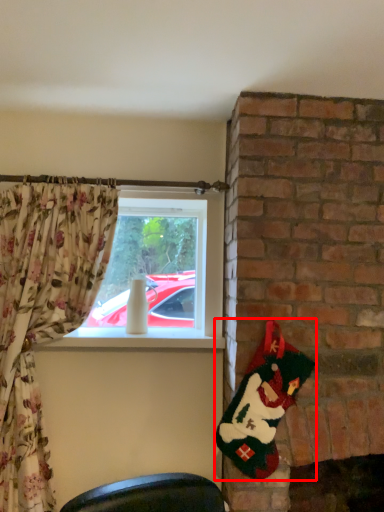
Question: From the image's perspective, where is santa claus (annotated by the red box) located in relation to window in the image?

Choices:
 (A) above
 (B) below

Answer: (B)